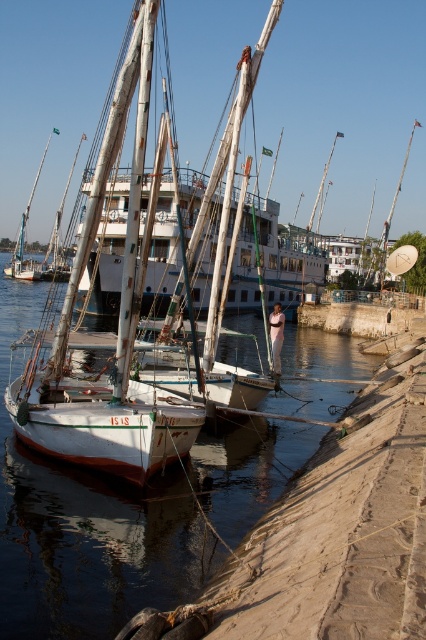
Question: Does white matte sailboat at center have a larger size compared to white wood mast at upper center?

Choices:
 (A) yes
 (B) no

Answer: (B)

Question: Is white matte water at lower left positioned behind white wood mast at upper center?

Choices:
 (A) no
 (B) yes

Answer: (A)

Question: Which object appears farthest from the camera in this image?

Choices:
 (A) white matte sailboat at center
 (B) white wood mast at upper center
 (C) white matte mast at upper right
 (D) white matte water at lower left

Answer: (B)

Question: Which point appears farthest from the camera in this image?

Choices:
 (A) (414, 125)
 (B) (247, 320)

Answer: (A)

Question: Among these points, which one is farthest from the camera?

Choices:
 (A) (382, 269)
 (B) (31, 556)
 (C) (324, 168)

Answer: (C)

Question: Can you confirm if white matte water at lower left is positioned below white matte mast at upper right?

Choices:
 (A) no
 (B) yes

Answer: (B)